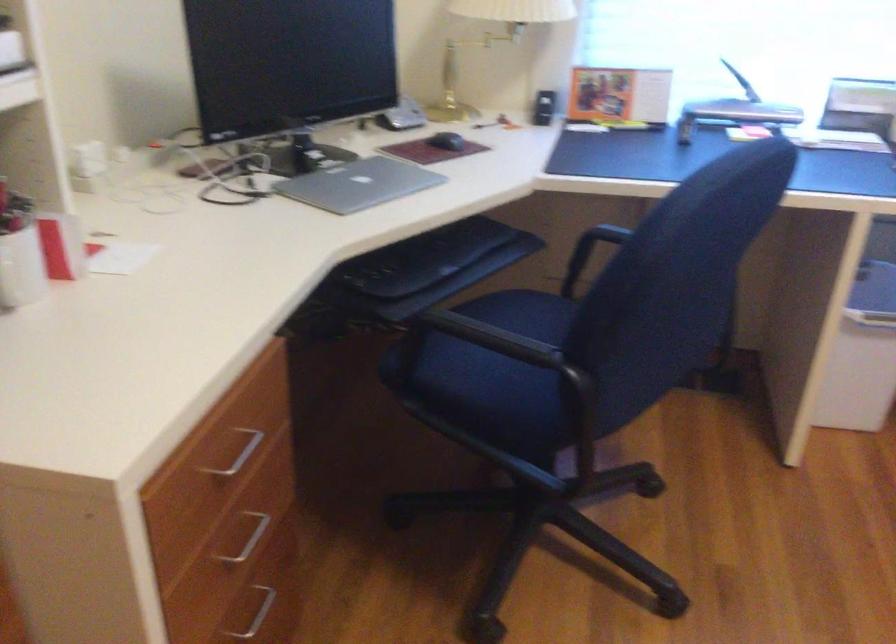
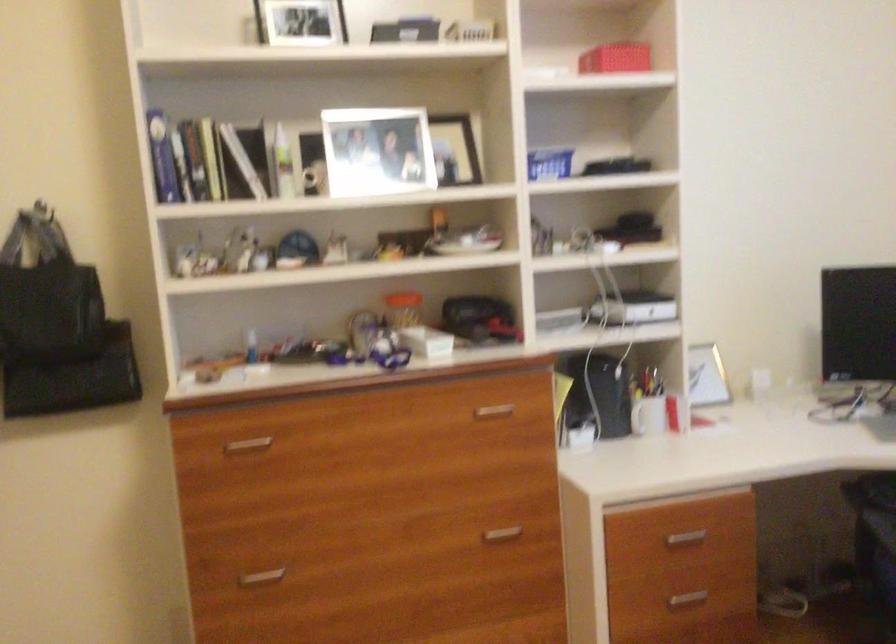
In the second image, find the point that corresponds to the point at 240,554 in the first image.

(686, 599)